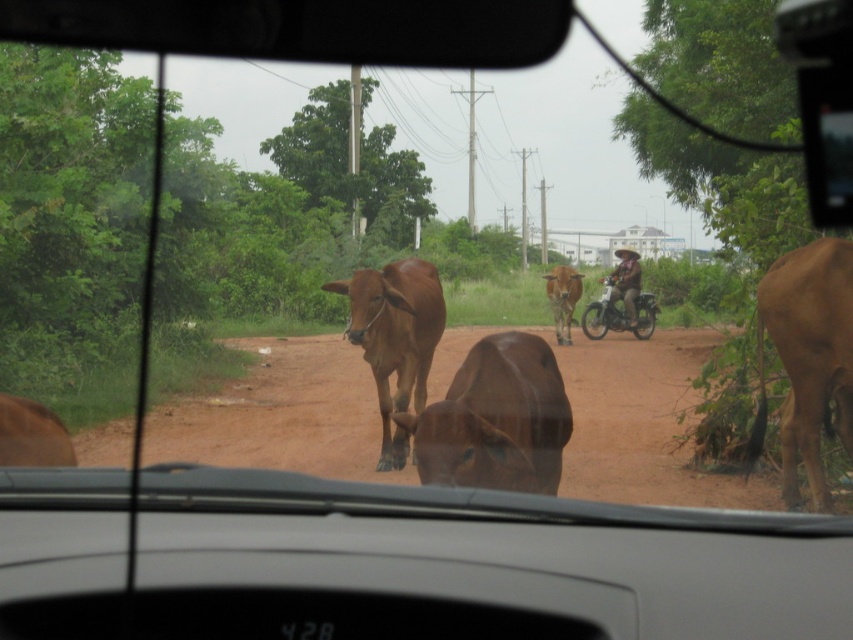
You are driving a car and need to pass through the brown dirt track at center. There is a brown matte bull at right blocking the way. Can you safely navigate around the bull without leaving the dirt track?

The brown dirt track at center is shorter than the brown matte bull at right, so it may not provide enough space to safely navigate around the bull without leaving the dirt track. Consider waiting for the bull to move or finding an alternative route.

You are driving a car and see the brown dirt track at center and the brown matte bull at right. Which object is closer to the left side of the road?

The brown dirt track at center is positioned on the left side of brown matte bull at right, so the brown dirt track at center is closer to the left side of the road.

You are driving a car and see two points on the road ahead. The first point is at coordinate point(x=583, y=433) and the second is at point(x=656, y=301). Which point is closer to your current position?

Point(x=583, y=433) is in front of point(x=656, y=301), so the first point is closer to your current position.